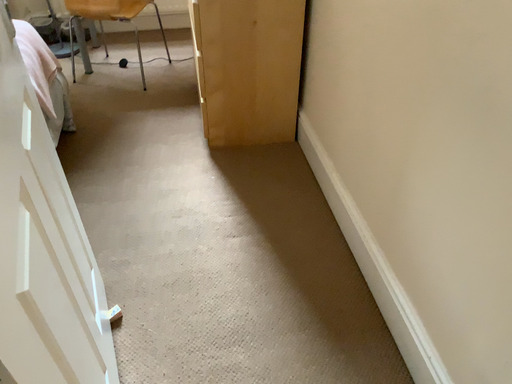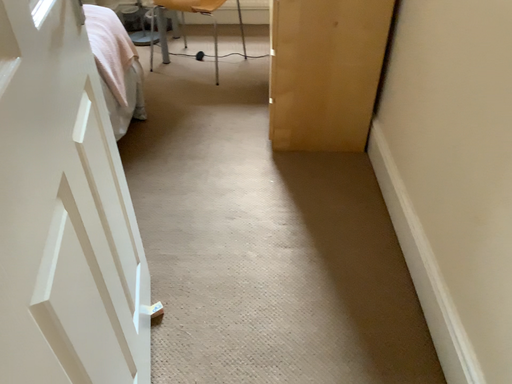
Question: Which way did the camera rotate in the video?

Choices:
 (A) rotated left
 (B) rotated right

Answer: (A)